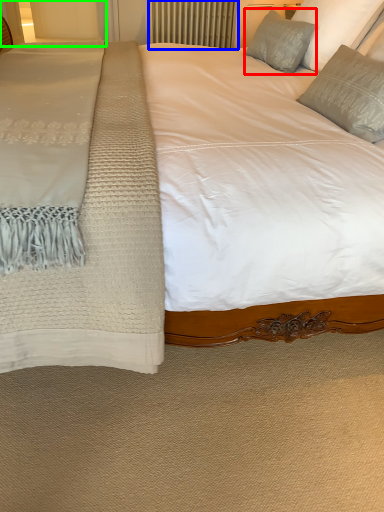
Question: Estimate the real-world distances between objects in this image. Which object is closer to pillow (highlighted by a red box), radiator (highlighted by a blue box) or glass door (highlighted by a green box)?

Choices:
 (A) radiator
 (B) glass door

Answer: (B)